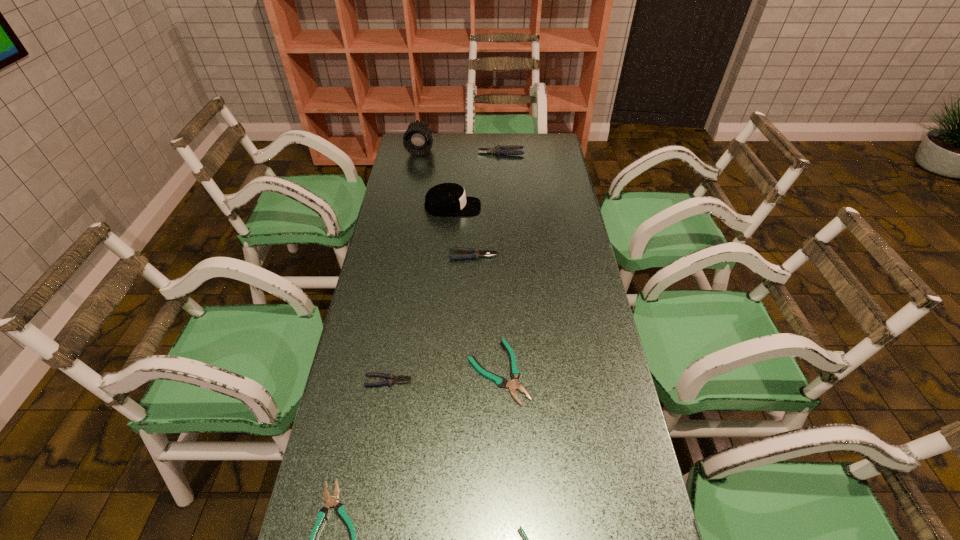
Where is `black telephoto lens`? This screenshot has height=540, width=960. black telephoto lens is located at coordinates (417, 140).

Identify the location of the tallest object. (417, 140).

Find the location of `black cap`. black cap is located at coordinates (443, 199).

Locate an element on the screen. The height and width of the screenshot is (540, 960). cap is located at coordinates (443, 199).

You are a GUI agent. You are given a task and a screenshot of the screen. Output one action in this format:
    pyautogui.click(x=<x>, y=<y>)
    Task: Click on the biggest gray pliers
    This screenshot has height=540, width=960.
    Given the screenshot: What is the action you would take?
    pyautogui.click(x=507, y=150)

Image resolution: width=960 pixels, height=540 pixels. Find the location of `the farthest pliers`. the farthest pliers is located at coordinates (507, 150).

This screenshot has width=960, height=540. In order to click on the fifth shortest object in this screenshot , I will do `click(476, 253)`.

Where is `the second farthest pliers`? Image resolution: width=960 pixels, height=540 pixels. the second farthest pliers is located at coordinates (476, 253).

You are a GUI agent. You are given a task and a screenshot of the screen. Output one action in this format:
    pyautogui.click(x=<x>, y=<y>)
    Task: Click on the leftmost gray pliers
    
    Given the screenshot: What is the action you would take?
    pyautogui.click(x=391, y=378)

I want to click on the nearest gray pliers, so click(391, 378).